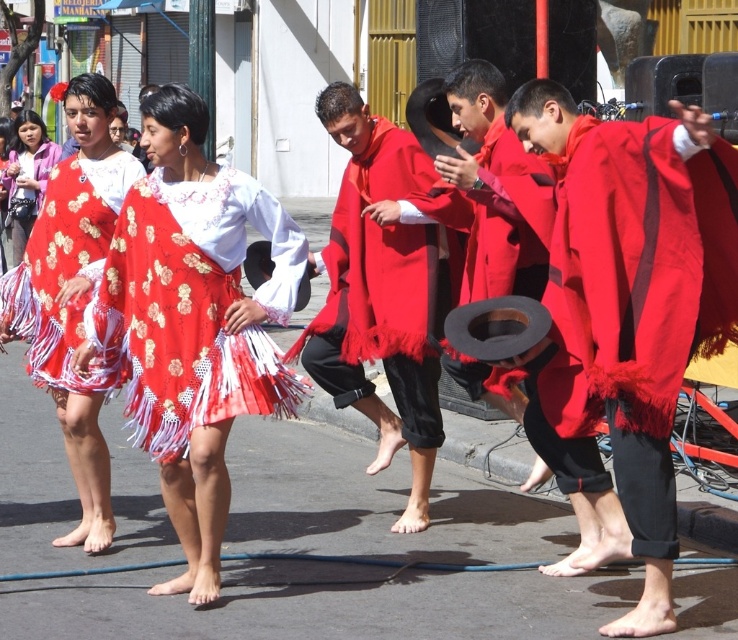
Does matte red dress at center have a lesser height compared to matte pink blouse at left?

No, matte red dress at center is not shorter than matte pink blouse at left.

What do you see at coordinates (72, 292) in the screenshot? I see `matte red dress at center` at bounding box center [72, 292].

What are the coordinates of `matte red dress at center` in the screenshot? It's located at (72, 292).

Who is taller, matte red dress at center or matte black hat at center?

Standing taller between the two is matte red dress at center.

Which is in front, point (96, 493) or point (466, 61)?

Point (96, 493) is in front.

This screenshot has height=640, width=738. In order to click on matte red dress at center in this screenshot , I will do `click(72, 292)`.

How much distance is there between matte red dress at center and matte red dress at left?

matte red dress at center and matte red dress at left are 9.26 meters apart.

Does point (66, 106) come in front of point (0, 268)?

Yes.

Is point (69, 224) positioned in front of point (1, 140)?

That is True.

At what (x,y) coordinates should I click in order to perform the action: click on matte red dress at center. Please return your answer as a coordinate pair (x, y). Looking at the image, I should click on (72, 292).